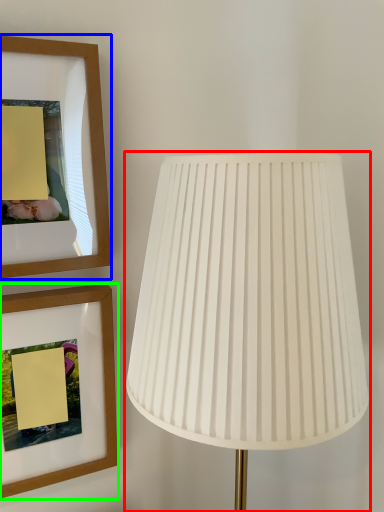
Question: Which is nearer to the lamp (highlighted by a red box)? picture frame (highlighted by a blue box) or picture frame (highlighted by a green box).

Choices:
 (A) picture frame
 (B) picture frame

Answer: (A)